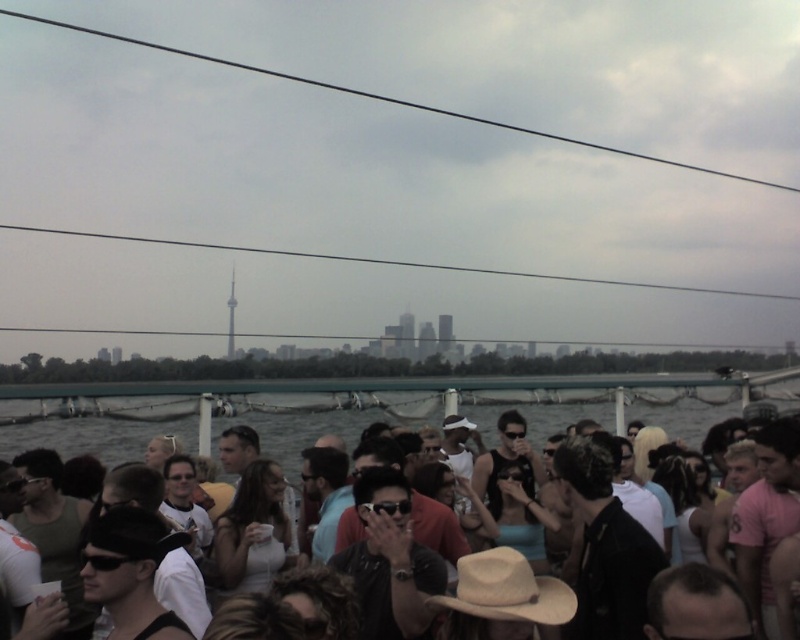
You are a photographer trying to capture a photo of the green water at lower center and the matte black hat at center. Since you want both objects to be clearly visible, which one should you focus on first to ensure proper focus?

The green water at lower center is bigger than the matte black hat at center, so focusing on the green water at lower center first will ensure it is in focus, and the matte black hat at center may also be in focus due to its smaller size.

You are at the boat party and want to take a photo of the city skyline with the green water at lower center and the matte black hat at center in the frame. Which object should be placed to the left to include both in the photo?

The green water at lower center should be placed to the left of the matte black hat at center in the photo to include both in the frame since the green water at lower center is positioned on the left side of matte black hat at center.